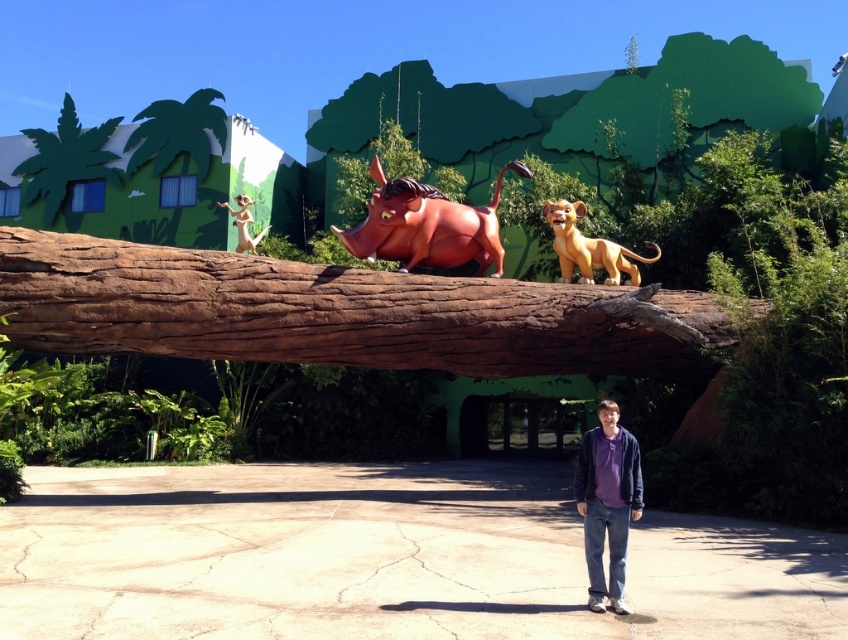
Question: Which object is farther from the camera taking this photo?

Choices:
 (A) shiny orange rhino at center
 (B) shiny silver monkey at upper left
 (C) green painted palm tree at upper left
 (D) brown rough wood at center

Answer: (C)

Question: Is brown rough wood at center further to camera compared to purple cotton shirt at lower center?

Choices:
 (A) yes
 (B) no

Answer: (A)

Question: Can you confirm if shiny orange rhino at center is positioned below shiny silver monkey at upper left?

Choices:
 (A) yes
 (B) no

Answer: (A)

Question: Among these objects, which one is nearest to the camera?

Choices:
 (A) green painted palm tree at upper left
 (B) shiny orange rhino at center
 (C) purple cotton shirt at lower center
 (D) golden matte lion at center

Answer: (C)

Question: Which of the following is the closest to the observer?

Choices:
 (A) green painted palm tree at upper left
 (B) shiny orange rhino at center
 (C) golden matte lion at center
 (D) shiny silver monkey at upper left

Answer: (B)

Question: Does brown rough wood at center lie in front of green painted palm tree at upper left?

Choices:
 (A) no
 (B) yes

Answer: (B)